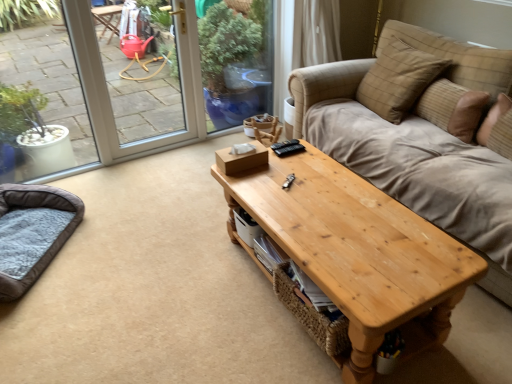
Question: Does natural wood coffee table at center have a smaller size compared to dark brown plush cat bed at lower left?

Choices:
 (A) yes
 (B) no

Answer: (B)

Question: From the image's perspective, is natural wood coffee table at center above dark brown plush cat bed at lower left?

Choices:
 (A) yes
 (B) no

Answer: (B)

Question: Considering the relative sizes of natural wood coffee table at center and dark brown plush cat bed at lower left in the image provided, is natural wood coffee table at center thinner than dark brown plush cat bed at lower left?

Choices:
 (A) yes
 (B) no

Answer: (B)

Question: Is natural wood coffee table at center at the left side of dark brown plush cat bed at lower left?

Choices:
 (A) no
 (B) yes

Answer: (A)

Question: Does natural wood coffee table at center have a larger size compared to dark brown plush cat bed at lower left?

Choices:
 (A) no
 (B) yes

Answer: (B)

Question: From a real-world perspective, is natural wood coffee table at center on top of dark brown plush cat bed at lower left?

Choices:
 (A) yes
 (B) no

Answer: (A)

Question: Would you say brown textured pillow at upper right, the first pillow from the right, is outside dark brown plush cat bed at lower left?

Choices:
 (A) no
 (B) yes

Answer: (B)

Question: Is brown textured pillow at upper right, the first pillow from the right, turned away from dark brown plush cat bed at lower left?

Choices:
 (A) yes
 (B) no

Answer: (B)

Question: Can you confirm if brown textured pillow at upper right, which is the 2th pillow in left-to-right order, is smaller than dark brown plush cat bed at lower left?

Choices:
 (A) yes
 (B) no

Answer: (A)

Question: Is the depth of brown textured pillow at upper right, the first pillow from the right, less than that of dark brown plush cat bed at lower left?

Choices:
 (A) no
 (B) yes

Answer: (A)

Question: Is brown textured pillow at upper right, the first pillow from the right, to the right of dark brown plush cat bed at lower left from the viewer's perspective?

Choices:
 (A) yes
 (B) no

Answer: (A)

Question: Is brown textured pillow at upper right, the first pillow from the right, taller than dark brown plush cat bed at lower left?

Choices:
 (A) no
 (B) yes

Answer: (B)

Question: From the image's perspective, is brown textured pillow at upper right, the first pillow from the right, beneath plaid fabric pillow at upper right, the second pillow from the right?

Choices:
 (A) no
 (B) yes

Answer: (B)